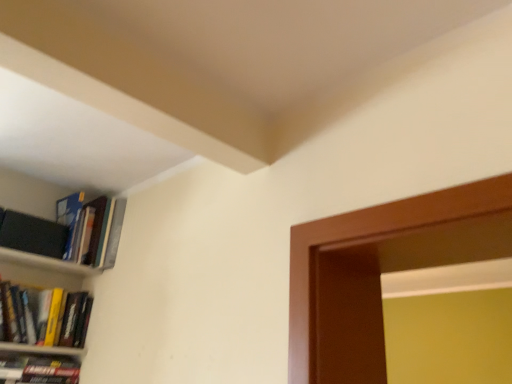
Question: Does point (28, 309) appear closer or farther from the camera than point (75, 236)?

Choices:
 (A) farther
 (B) closer

Answer: (B)

Question: Is hardcover book at left, which appears as the second book when viewed from the top, in front of or behind hardcover books at upper left, placed as the first book when sorted from top to bottom, in the image?

Choices:
 (A) front
 (B) behind

Answer: (A)

Question: Is hardcover book at left, which is counted as the first book, starting from the bottom, inside or outside of hardcover books at upper left, placed as the first book when sorted from top to bottom?

Choices:
 (A) inside
 (B) outside

Answer: (B)

Question: Relative to hardcover book at left, which is counted as the first book, starting from the bottom, is hardcover books at upper left, placed as the first book when sorted from top to bottom, in front or behind?

Choices:
 (A) behind
 (B) front

Answer: (A)

Question: From the image's perspective, is hardcover books at upper left, the second book when ordered from bottom to top, above or below hardcover book at left, which appears as the second book when viewed from the top?

Choices:
 (A) above
 (B) below

Answer: (A)

Question: Is point (115, 198) positioned closer to the camera than point (58, 297)?

Choices:
 (A) closer
 (B) farther

Answer: (B)

Question: In terms of height, does hardcover books at upper left, placed as the first book when sorted from top to bottom, look taller or shorter compared to hardcover book at left, which appears as the second book when viewed from the top?

Choices:
 (A) short
 (B) tall

Answer: (B)